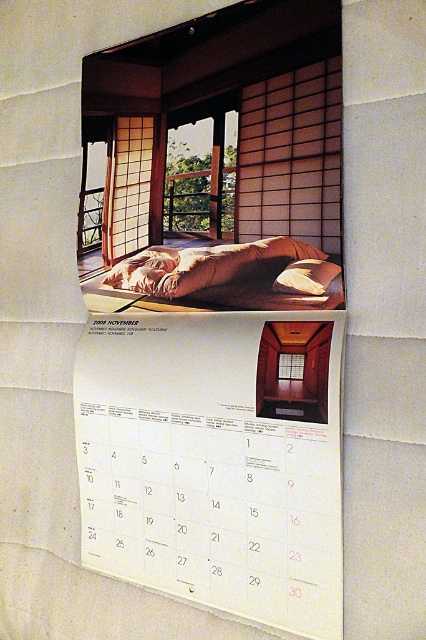
Question: Does brown fabric bed at upper center appear over matte wood window at center?

Choices:
 (A) no
 (B) yes

Answer: (B)

Question: In this image, where is white paper calendar at center located relative to matte wood window at center?

Choices:
 (A) above
 (B) below

Answer: (B)

Question: Can you confirm if white paper calendar at center is smaller than matte wood window at center?

Choices:
 (A) yes
 (B) no

Answer: (B)

Question: Estimate the real-world distances between objects in this image. Which object is farther from the brown fabric bed at upper center?

Choices:
 (A) white paper calendar at center
 (B) matte wood window at center
 (C) suede-like beige pillow at center

Answer: (A)

Question: Among these points, which one is farthest from the camera?

Choices:
 (A) (325, 474)
 (B) (324, 268)
 (C) (302, 368)

Answer: (C)

Question: Which is nearer to the white paper calendar at center?

Choices:
 (A) matte wood window at center
 (B) suede-like beige pillow at center
 (C) brown fabric bed at upper center

Answer: (C)